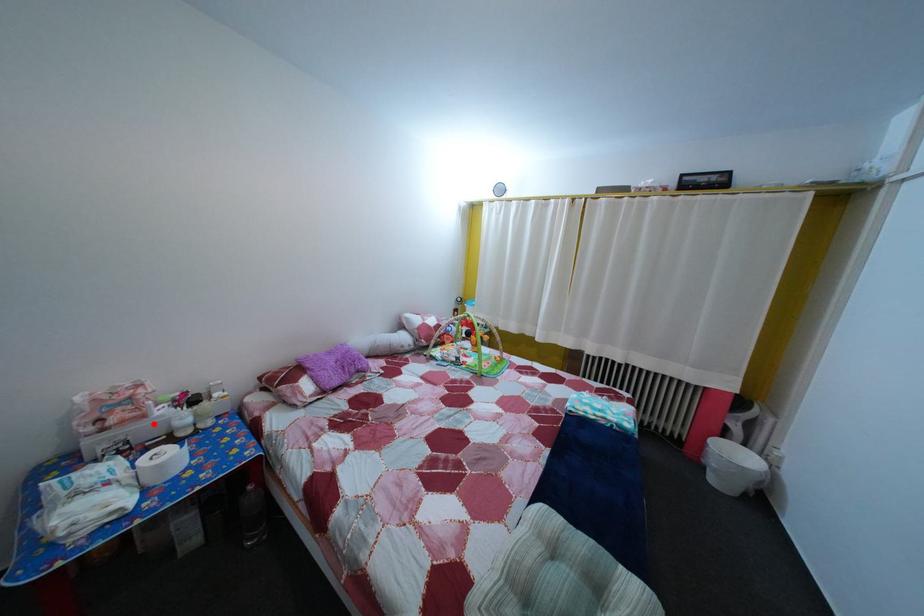
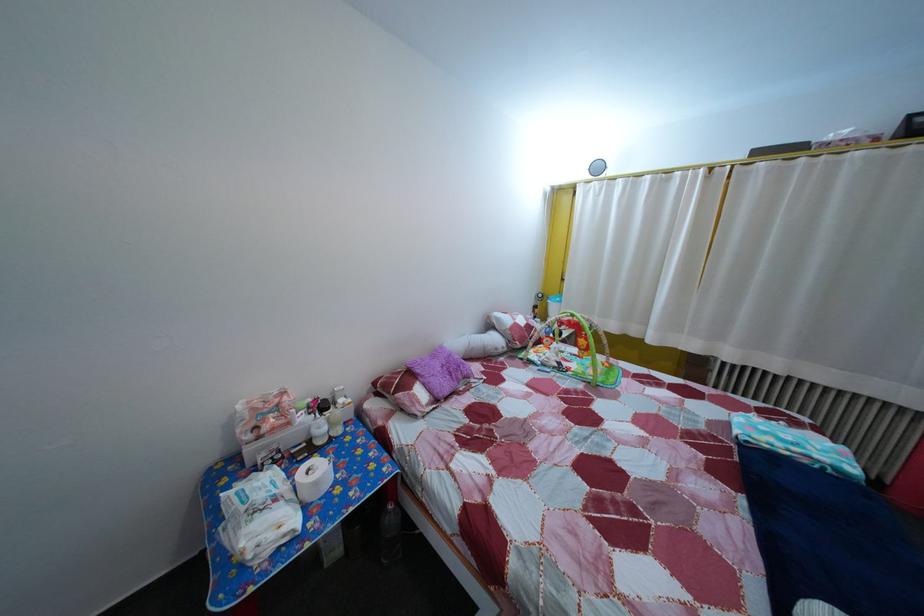
In the second image, find the point that corresponds to the highlighted location in the first image.

(298, 432)